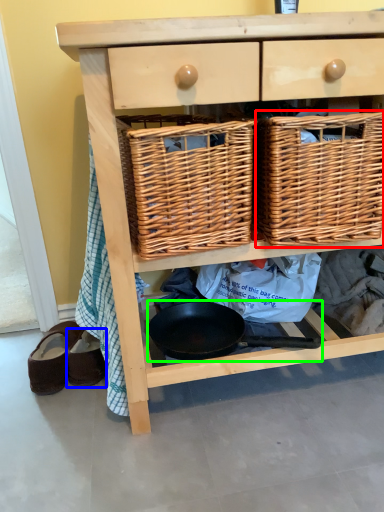
Question: Based on their relative distances, which object is farther from picnic basket (highlighted by a red box)? Choose from footwear (highlighted by a blue box) and frying pan (highlighted by a green box).

Choices:
 (A) footwear
 (B) frying pan

Answer: (A)